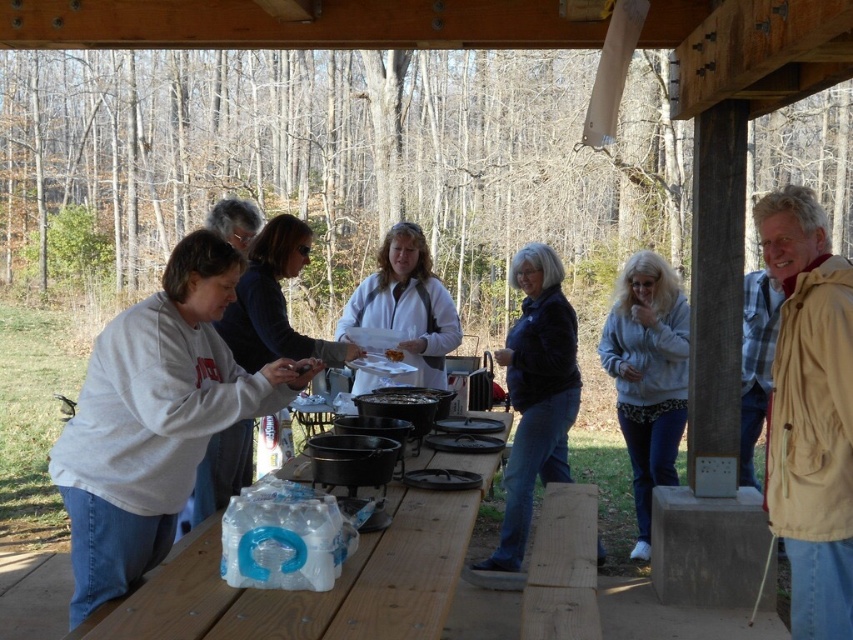
Is beige fabric jacket at right to the left of gray fleece jacket at center from the viewer's perspective?

Correct, you'll find beige fabric jacket at right to the left of gray fleece jacket at center.

Between beige fabric jacket at right and gray fleece jacket at center, which one is positioned lower?

gray fleece jacket at center is lower down.

Identify the location of beige fabric jacket at right. (810, 412).

What are the coordinates of `beige fabric jacket at right` in the screenshot? It's located at (810, 412).

How much distance is there between beige fabric jacket at right and dark blue jacket at center?

beige fabric jacket at right and dark blue jacket at center are 1.84 meters apart from each other.

Between point (799, 576) and point (572, 381), which one is positioned behind?

The point (572, 381) is behind.

Which is in front, point (845, 314) or point (521, 532)?

Point (845, 314)

Image resolution: width=853 pixels, height=640 pixels. I want to click on beige fabric jacket at right, so click(810, 412).

Does white matte sweatshirt at left have a lesser width compared to dark blue jacket at center?

In fact, white matte sweatshirt at left might be wider than dark blue jacket at center.

Between point (126, 500) and point (570, 392), which one is positioned behind?

Positioned behind is point (570, 392).

I want to click on white matte sweatshirt at left, so click(155, 419).